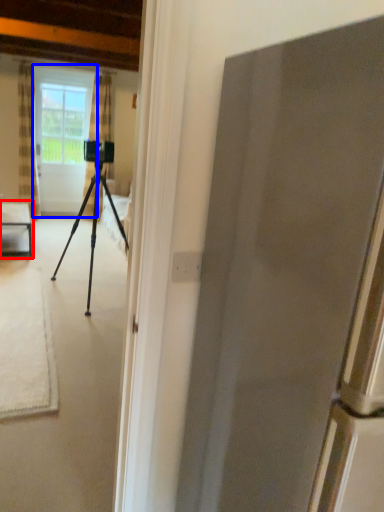
Question: Among these objects, which one is nearest to the camera, table (highlighted by a red box) or screen door (highlighted by a blue box)?

Choices:
 (A) table
 (B) screen door

Answer: (A)